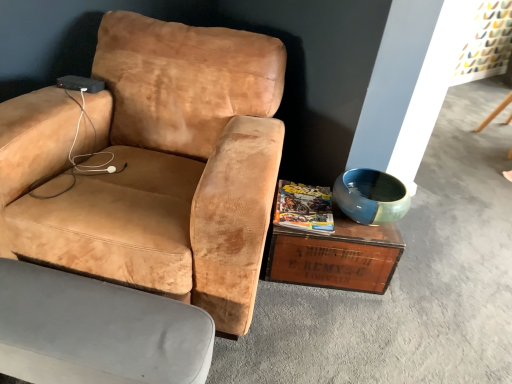
At what (x,y) coordinates should I click in order to perform the action: click on free spot above velvet beige armchair at lower left, the 2th chair when ordered from top to bottom (from a real-world perspective). Please return your answer as a coordinate pair (x, y). The height and width of the screenshot is (384, 512). Looking at the image, I should click on (81, 315).